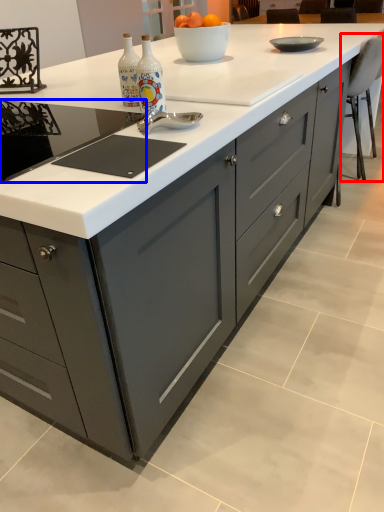
Question: Among these objects, which one is farthest to the camera, chair (highlighted by a red box) or gas stove (highlighted by a blue box)?

Choices:
 (A) chair
 (B) gas stove

Answer: (A)